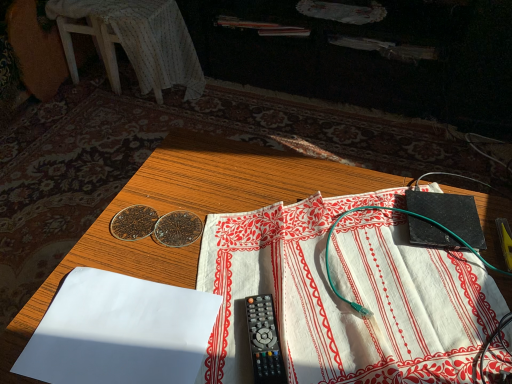
Question: Relative to white cloth at center, acting as the 1th sheet starting from the right, is white fabric-covered stool at upper left in front or behind?

Choices:
 (A) behind
 (B) front

Answer: (A)

Question: Is white fabric-covered stool at upper left bigger or smaller than white cloth at center, which is counted as the second sheet, starting from the left?

Choices:
 (A) big
 (B) small

Answer: (A)

Question: Which is nearer to the white paper at lower left, which appears as the 1th sheet when viewed from the left?

Choices:
 (A) black plastic remote control at center
 (B) white fabric-covered stool at upper left
 (C) white cloth at center, acting as the 1th sheet starting from the right
 (D) wooden table at center

Answer: (D)

Question: Which is farther from the white cloth at center, acting as the 1th sheet starting from the right?

Choices:
 (A) white paper at lower left, the 2th sheet from the right
 (B) black plastic remote control at center
 (C) white fabric-covered stool at upper left
 (D) wooden table at center

Answer: (C)